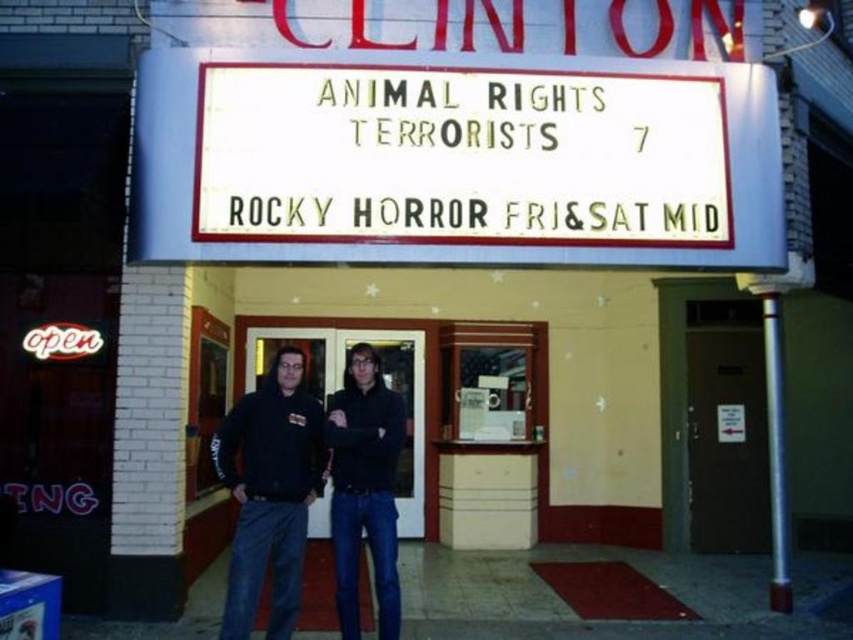
Identify the location of black hoodie at center. (270, 493).

Consider the image. Which is below, black hoodie at center or black matte hoodie at center?

black matte hoodie at center

In the scene shown: Who is more forward, (x=294, y=515) or (x=366, y=368)?

Positioned in front is point (x=294, y=515).

Where is `black hoodie at center`? The width and height of the screenshot is (853, 640). black hoodie at center is located at coordinates (270, 493).